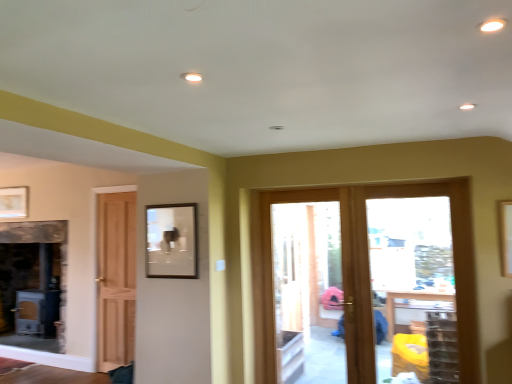
Question: Is matte gold picture frame at upper left, which is counted as the first picture frame, starting from the back, in front of or behind clear glass door at center in the image?

Choices:
 (A) behind
 (B) front

Answer: (A)

Question: Considering the positions of point (20, 215) and point (269, 231), is point (20, 215) closer or farther from the camera than point (269, 231)?

Choices:
 (A) farther
 (B) closer

Answer: (A)

Question: Based on their relative distances, which object is nearer to the wooden door at center?

Choices:
 (A) matte gold picture frame at upper left, the second picture frame positioned from the right
 (B) clear glass door at center
 (C) matte brown picture frame at upper center, which appears as the 2th picture frame when viewed from the left
 (D) clear glass door at center

Answer: (B)

Question: Which of these objects is positioned closest to the wooden door at center?

Choices:
 (A) matte gold picture frame at upper left, which is counted as the first picture frame, starting from the back
 (B) clear glass door at center
 (C) matte brown picture frame at upper center, which appears as the 2th picture frame when viewed from the left
 (D) clear glass door at center

Answer: (D)